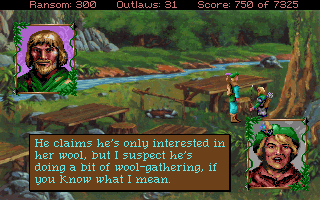
The width and height of the screenshot is (320, 200). I want to click on table, so click(x=204, y=88).